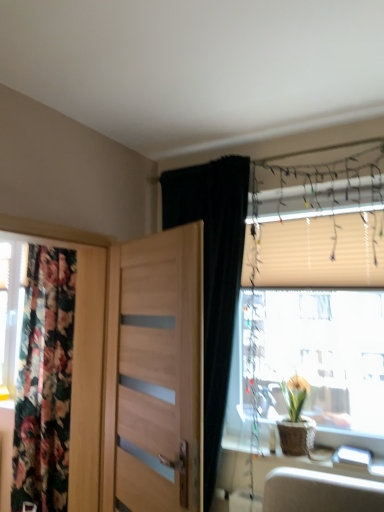
Locate an element on the screen. The width and height of the screenshot is (384, 512). free spot above translucent plastic window at right (from a real-world perspective) is located at coordinates (312, 193).